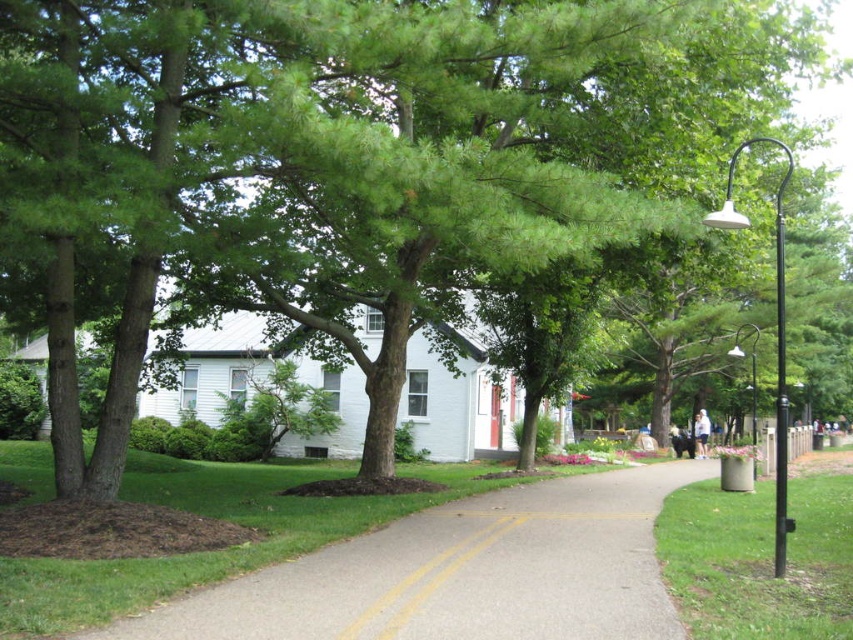
Is yellow asphalt road at center wider than black metal lamp post at right?

No, yellow asphalt road at center is not wider than black metal lamp post at right.

Identify the location of yellow asphalt road at center. This screenshot has height=640, width=853. (425, 582).

This screenshot has width=853, height=640. In order to click on yellow asphalt road at center in this screenshot , I will do [425, 582].

Is gray asphalt pavement at center in front of yellow asphalt road at center?

That is True.

Between point (405, 602) and point (424, 564), which one is positioned behind?

The point (424, 564) is behind.

Where is `gray asphalt pavement at center`? This screenshot has height=640, width=853. gray asphalt pavement at center is located at coordinates pyautogui.click(x=461, y=572).

Who is more forward, (601, 625) or (727, 221)?

Point (601, 625) is in front.

In the scene shown: Does gray asphalt pavement at center appear under black metal lamp post at right?

Yes.

This screenshot has height=640, width=853. What are the coordinates of `gray asphalt pavement at center` in the screenshot? It's located at (461, 572).